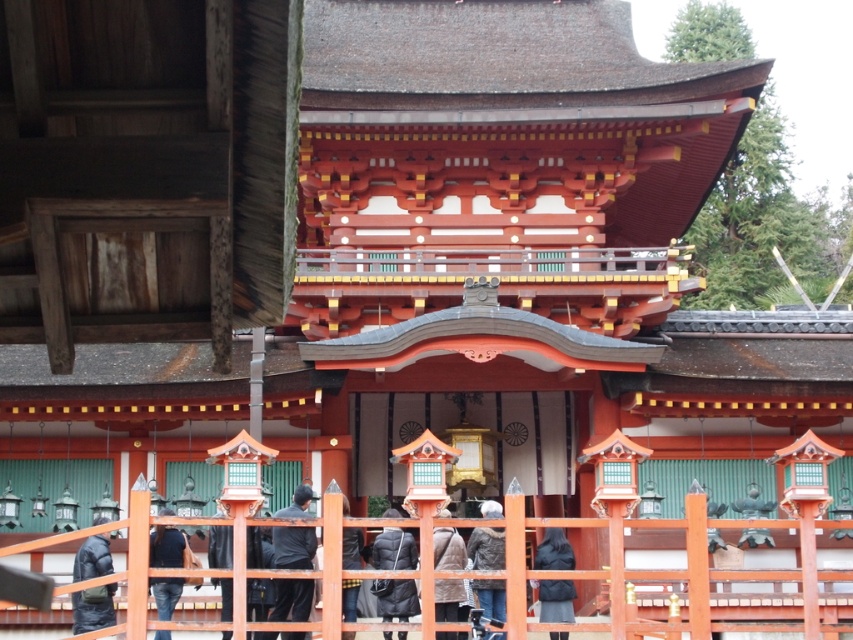
Between point (85, 589) and point (462, 547), which one is positioned behind?

The point (462, 547) is more distant.

The height and width of the screenshot is (640, 853). Find the location of `black puffy jacket at lower left`. black puffy jacket at lower left is located at coordinates (91, 609).

Does gray woolen jacket at center have a lesser width compared to dark gray fabric jacket at center?

Correct, gray woolen jacket at center's width is less than dark gray fabric jacket at center's.

Is gray woolen jacket at center closer to camera compared to dark gray fabric jacket at center?

No, it is not.

Which is behind, point (483, 595) or point (451, 536)?

The point (451, 536) is more distant.

Where is `gray woolen jacket at center`? Image resolution: width=853 pixels, height=640 pixels. gray woolen jacket at center is located at coordinates (486, 547).

Does wooden fence at center have a lesser height compared to black puffer jacket at center?

No, wooden fence at center is not shorter than black puffer jacket at center.

The height and width of the screenshot is (640, 853). Describe the element at coordinates (622, 561) in the screenshot. I see `wooden fence at center` at that location.

Does point (750, 522) lie in front of point (376, 612)?

Yes, it is.

At what (x,y) coordinates should I click in order to perform the action: click on wooden fence at center. Please return your answer as a coordinate pair (x, y). Looking at the image, I should click on (622, 561).